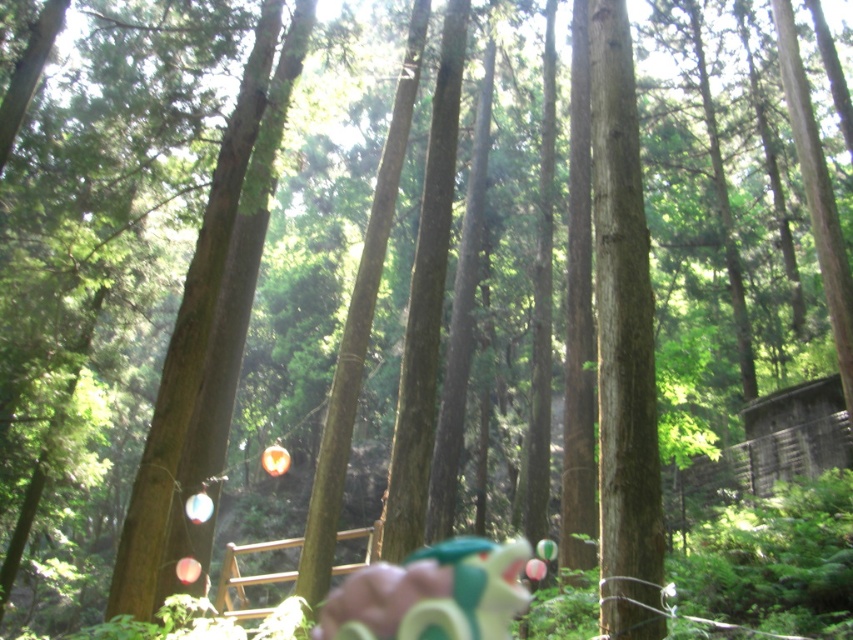
Is point (519, 572) behind point (363, 532)?

Yes, it is.

This screenshot has width=853, height=640. What are the coordinates of `green rubber dragon at center` in the screenshot? It's located at (448, 593).

Locate an element on the screen. green rubber dragon at center is located at coordinates (448, 593).